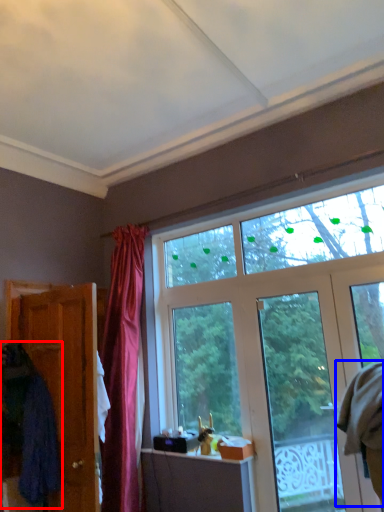
Question: Which point is closer to the camera, robe (highlighted by a red box) or robe (highlighted by a blue box)?

Choices:
 (A) robe
 (B) robe

Answer: (A)